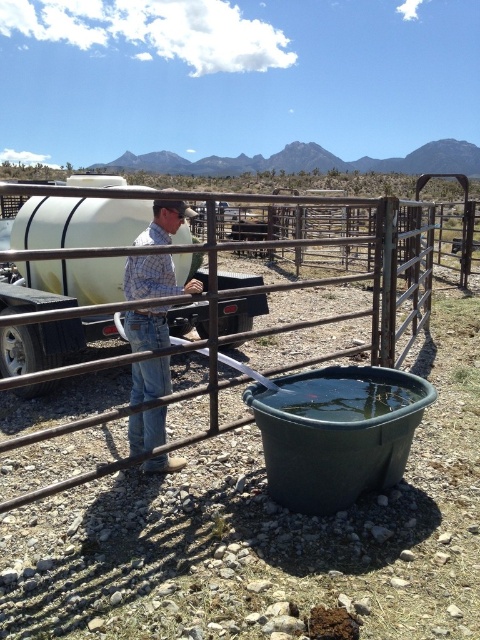
Does point (416, 204) come closer to viewer compared to point (70, 356)?

No, it is behind (70, 356).

Between rustic metal fence at center and white matte trailer truck at center, which one has less height?

white matte trailer truck at center is shorter.

Which is behind, point (298, 228) or point (103, 292)?

The point (298, 228) is more distant.

This screenshot has width=480, height=640. Identify the location of rustic metal fence at center. (342, 280).

Which is behind, point (412, 260) or point (160, 428)?

Positioned behind is point (412, 260).

Between rustic metal fence at center and plaid shirt at center, which one appears on the left side from the viewer's perspective?

From the viewer's perspective, plaid shirt at center appears more on the left side.

Is point (96, 358) less distant than point (151, 394)?

No, (96, 358) is behind (151, 394).

Find the location of a particular element. Image resolution: width=480 pixels, height=640 pixels. rustic metal fence at center is located at coordinates (342, 280).

Is white matte trailer truck at center smaller than plaid shirt at center?

Actually, white matte trailer truck at center might be larger than plaid shirt at center.

The image size is (480, 640). Identify the location of white matte trailer truck at center. (78, 221).

I want to click on white matte trailer truck at center, so click(78, 221).